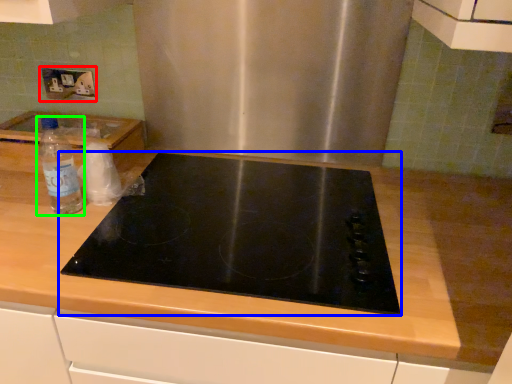
Question: Which object is positioned closest to electric outlet (highlighted by a red box)? Select from gas stove (highlighted by a blue box) and bottle (highlighted by a green box).

Choices:
 (A) gas stove
 (B) bottle

Answer: (B)